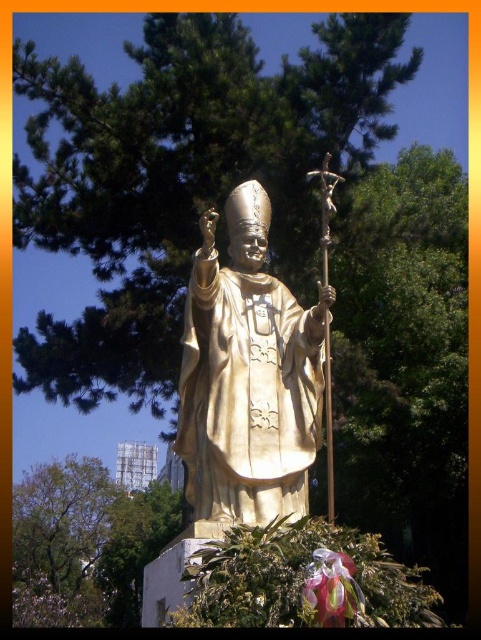
Question: Is gold polished statue at center in front of translucent pink petal at lower center?

Choices:
 (A) yes
 (B) no

Answer: (B)

Question: Which object is farther from the camera taking this photo?

Choices:
 (A) translucent pink petal at lower center
 (B) gold polished statue at center

Answer: (B)

Question: Does gold polished statue at center appear under translucent pink petal at lower center?

Choices:
 (A) no
 (B) yes

Answer: (A)

Question: Can you confirm if gold polished statue at center is smaller than translucent pink petal at lower center?

Choices:
 (A) no
 (B) yes

Answer: (A)

Question: Which object is closer to the camera taking this photo?

Choices:
 (A) gold polished statue at center
 (B) translucent pink petal at lower center

Answer: (B)

Question: Among these points, which one is nearest to the camera?

Choices:
 (A) (315, 621)
 (B) (287, 401)

Answer: (A)